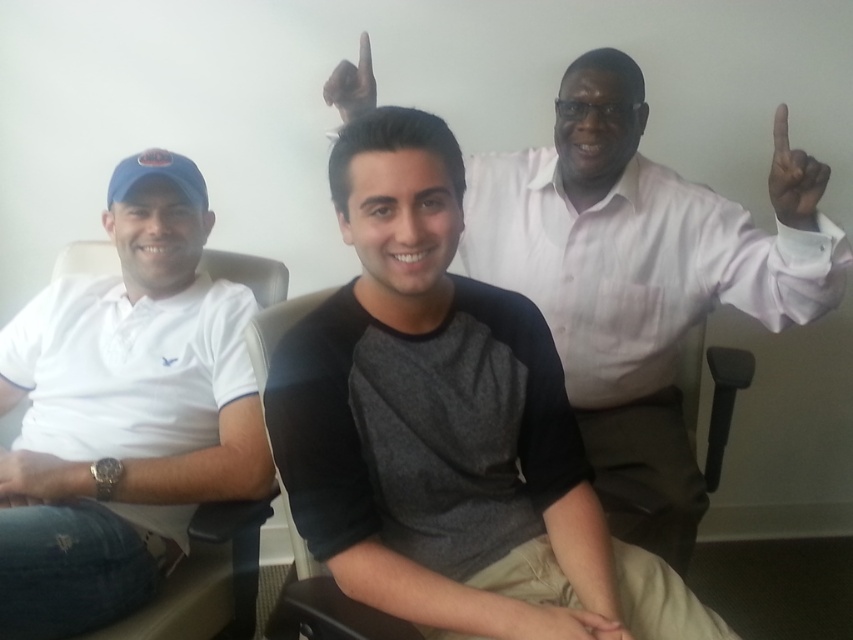
Is point (647, 269) farther from viewer compared to point (810, 230)?

Yes, it is behind point (810, 230).

Between point (584, 180) and point (784, 196), which one is positioned in front?

Point (784, 196) is more forward.

Which is in front, point (672, 368) or point (809, 225)?

Positioned in front is point (809, 225).

At what (x,y) coordinates should I click in order to perform the action: click on dark gray cotton shirt at center. Please return your answer as a coordinate pair (x, y). Looking at the image, I should click on (633, 278).

How far apart are white cotton polo shirt at left and black matte hand at upper right?

white cotton polo shirt at left and black matte hand at upper right are 3.71 feet apart from each other.

Is white cotton polo shirt at left to the left of black matte hand at upper right from the viewer's perspective?

Correct, you'll find white cotton polo shirt at left to the left of black matte hand at upper right.

Which is behind, point (67, 403) or point (796, 196)?

The point (67, 403) is more distant.

The width and height of the screenshot is (853, 640). I want to click on white cotton polo shirt at left, so click(123, 412).

Is point (670, 483) positioned before point (59, 348)?

That is False.

Does dark gray cotton shirt at center have a smaller size compared to white cotton polo shirt at left?

No.

Is point (660, 230) positioned behind point (209, 422)?

Yes, point (660, 230) is behind point (209, 422).

The height and width of the screenshot is (640, 853). Find the location of `dark gray cotton shirt at center`. dark gray cotton shirt at center is located at coordinates (633, 278).